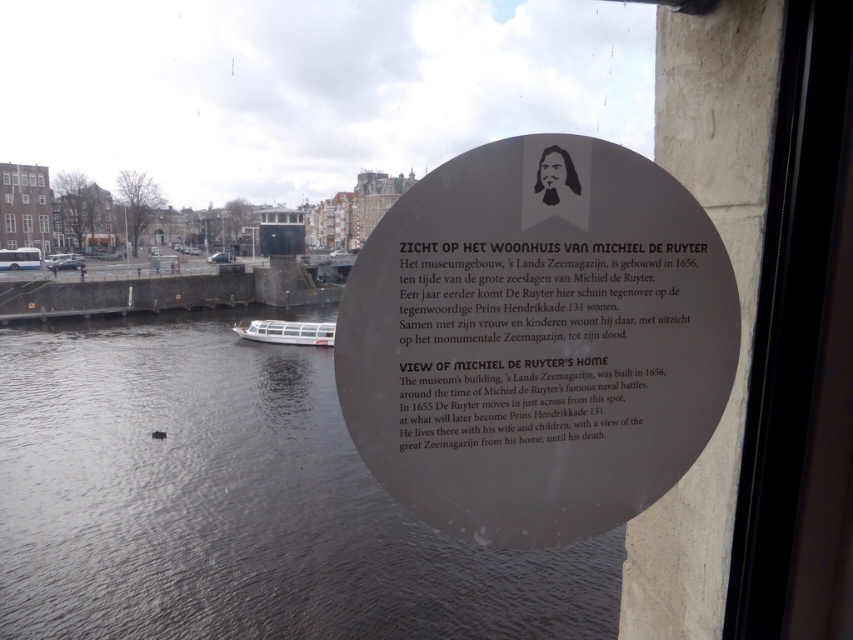
Question: Among these points, which one is nearest to the camera?

Choices:
 (A) (303, 340)
 (B) (624, 237)
 (C) (370, 632)
 (D) (550, 282)

Answer: (D)

Question: Does dark blue water at lower center appear over white plastic boat at lower center?

Choices:
 (A) yes
 (B) no

Answer: (B)

Question: Observing the image, what is the correct spatial positioning of black matte plaque at upper center in reference to matte black plaque at center?

Choices:
 (A) below
 (B) above

Answer: (A)

Question: Which of these objects is positioned closest to the black matte plaque at upper center?

Choices:
 (A) white plastic boat at lower center
 (B) dark blue water at lower center

Answer: (B)

Question: Does matte black plaque at center appear over white plastic boat at lower center?

Choices:
 (A) no
 (B) yes

Answer: (A)

Question: Which point is farther to the camera?

Choices:
 (A) (254, 368)
 (B) (287, 332)
 (C) (524, 301)

Answer: (B)